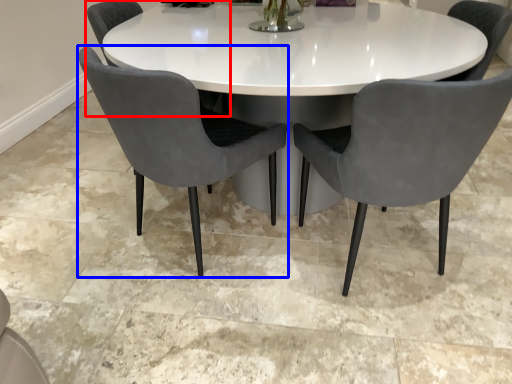
Question: Which object appears farthest to the camera in this image, chair (highlighted by a red box) or chair (highlighted by a blue box)?

Choices:
 (A) chair
 (B) chair

Answer: (A)